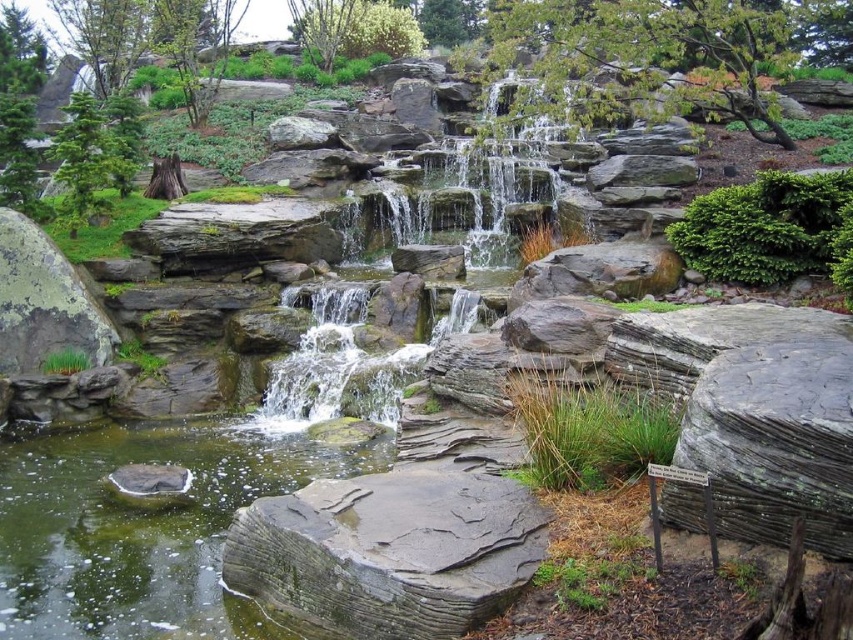
You are a gardener who wants to place a 3.5 meter long decorative bamboo bridge between the green mossy rock at center and the green mossy rock at left. Will the bridge fit perfectly between them?

The distance between the green mossy rock at center and the green mossy rock at left is 3.80 meters. Since the bridge is 3.5 meters long, it will fit with some space remaining between them.

You are standing in the garden and want to walk from the point at coordinates point (83, 504) to the point at coordinates point (288, 497). Which direction should you move to get closer to your destination?

To move from point (83, 504) to point (288, 497), you should move forward because point (83, 504) is behind point (288, 497).

You are standing at the edge of the garden and want to walk from point A to point B. Point A is at point (x=483, y=163) and point B is at point (x=16, y=305). Which point is closer to you when you start walking?

Point B at (x=16, y=305) is closer to you since it is in front of point A at (x=483, y=163).